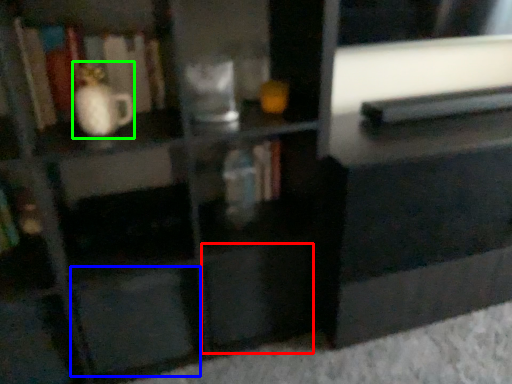
Question: Which object is the farthest from drawer (highlighted by a red box)? Choose among these: drawer (highlighted by a blue box) or vase (highlighted by a green box).

Choices:
 (A) drawer
 (B) vase

Answer: (B)